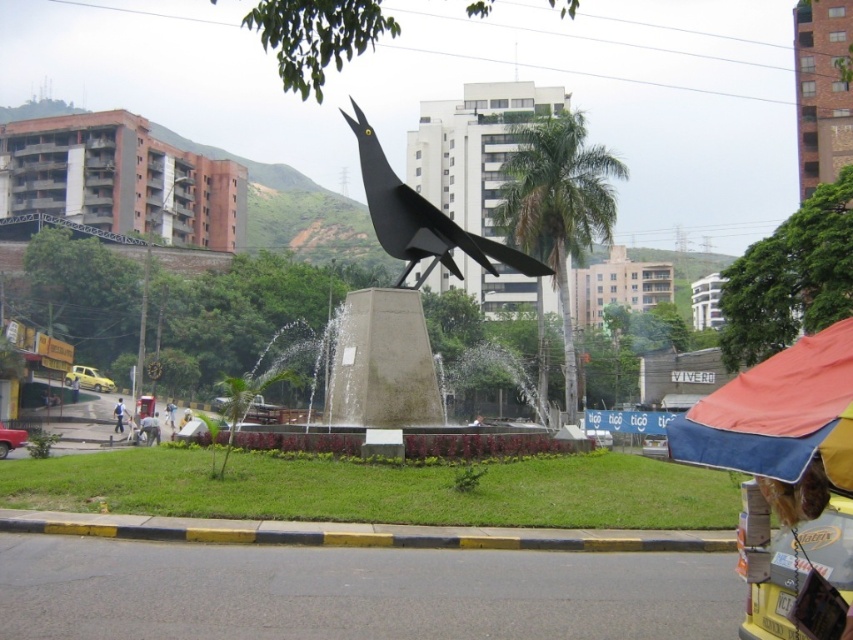
You are a city planner reviewing the layout of the plaza. The sculpture of the black matte bird at center is positioned at coordinates 0.342, 0.495. If you want to install a new bench that must be at least 2 meters away from any water feature, will the existing water jets from the pedestal qualify as a water feature? And is the distance sufficient?

The water jets emanating from the base of the pedestal qualify as a water feature. The black matte bird at center is located at point (421, 218). Since the water jets are part of the pedestal base, the bench must be placed at least 2 meters away from this location to comply with the requirement.

You are standing in the public square and see the light blue jeans at lower left. If you want to reach them quickly, should you walk towards the sculpture or away from it?

The light blue jeans at lower left is 128.91 feet away from camera, so you should walk towards the sculpture to reach them quickly.

You are standing at the edge of the plaza and want to take a photo of the black matte bird at center without the light blue jeans at lower left appearing in the frame. Which direction should you move to ensure the jeans are out of the shot?

Move to the left side of the plaza. Since the black matte bird at center is to the right of the light blue jeans at lower left, moving left will position the jeans out of the frame while keeping the bird in view.